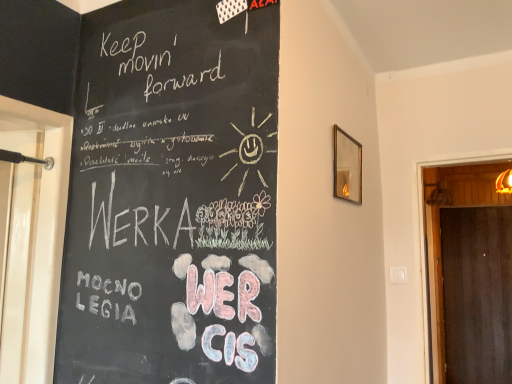
From the picture: Measure the distance between point [490,178] and camera.

Point [490,178] is 10.31 feet away from camera.

This screenshot has width=512, height=384. Find the location of `dark wood door at right`. dark wood door at right is located at coordinates (440, 235).

Describe the element at coordinates (440, 235) in the screenshot. The height and width of the screenshot is (384, 512). I see `dark wood door at right` at that location.

Identify the location of dark wood door at right. (440, 235).